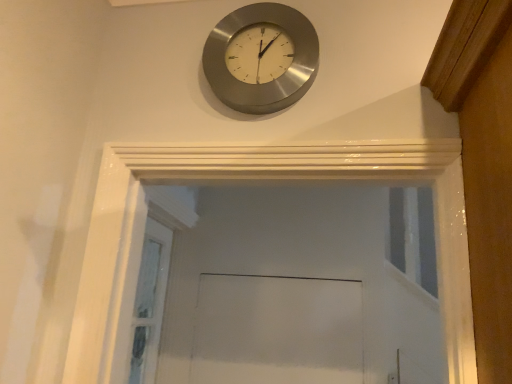
Question: Should I look upward or downward to see clear glass screen door at lower left?

Choices:
 (A) up
 (B) down

Answer: (B)

Question: Can you confirm if clear glass screen door at lower left is bigger than satin silver clock at upper center?

Choices:
 (A) no
 (B) yes

Answer: (B)

Question: Considering the relative sizes of clear glass screen door at lower left and satin silver clock at upper center in the image provided, is clear glass screen door at lower left taller than satin silver clock at upper center?

Choices:
 (A) no
 (B) yes

Answer: (B)

Question: Can you confirm if clear glass screen door at lower left is thinner than satin silver clock at upper center?

Choices:
 (A) no
 (B) yes

Answer: (A)

Question: Is satin silver clock at upper center at the back of clear glass screen door at lower left?

Choices:
 (A) yes
 (B) no

Answer: (B)

Question: Does clear glass screen door at lower left have a lesser height compared to satin silver clock at upper center?

Choices:
 (A) no
 (B) yes

Answer: (A)

Question: Does clear glass screen door at lower left lie behind satin silver clock at upper center?

Choices:
 (A) no
 (B) yes

Answer: (B)

Question: Can you confirm if satin silver clock at upper center is taller than clear glass screen door at lower left?

Choices:
 (A) no
 (B) yes

Answer: (A)

Question: Considering the relative positions of satin silver clock at upper center and clear glass screen door at lower left in the image provided, is satin silver clock at upper center to the left of clear glass screen door at lower left from the viewer's perspective?

Choices:
 (A) no
 (B) yes

Answer: (A)

Question: Considering the relative sizes of satin silver clock at upper center and clear glass screen door at lower left in the image provided, is satin silver clock at upper center smaller than clear glass screen door at lower left?

Choices:
 (A) no
 (B) yes

Answer: (B)

Question: Is the depth of satin silver clock at upper center greater than that of clear glass screen door at lower left?

Choices:
 (A) yes
 (B) no

Answer: (B)

Question: Could you tell me if satin silver clock at upper center is turned towards clear glass screen door at lower left?

Choices:
 (A) yes
 (B) no

Answer: (B)

Question: Is satin silver clock at upper center positioned in front of clear glass screen door at lower left?

Choices:
 (A) yes
 (B) no

Answer: (A)

Question: From the image's perspective, is satin silver clock at upper center above or below clear glass screen door at lower left?

Choices:
 (A) above
 (B) below

Answer: (A)